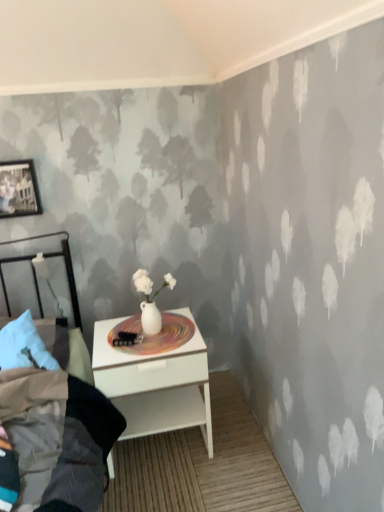
Question: From a real-world perspective, is matte black picture frame at upper left physically above white glossy vase at center?

Choices:
 (A) no
 (B) yes

Answer: (B)

Question: Is matte black picture frame at upper left taller than white glossy vase at center?

Choices:
 (A) no
 (B) yes

Answer: (B)

Question: Does matte black picture frame at upper left have a larger size compared to white glossy vase at center?

Choices:
 (A) no
 (B) yes

Answer: (B)

Question: Does matte black picture frame at upper left have a greater width compared to white glossy vase at center?

Choices:
 (A) no
 (B) yes

Answer: (A)

Question: Is white glossy vase at center surrounded by matte black picture frame at upper left?

Choices:
 (A) no
 (B) yes

Answer: (A)

Question: Is matte black picture frame at upper left oriented away from white glossy vase at center?

Choices:
 (A) no
 (B) yes

Answer: (A)

Question: Is white glossy nightstand at lower center placed right next to matte black picture frame at upper left?

Choices:
 (A) no
 (B) yes

Answer: (A)

Question: Is white glossy nightstand at lower center aimed at matte black picture frame at upper left?

Choices:
 (A) yes
 (B) no

Answer: (B)

Question: Does white glossy nightstand at lower center have a lesser height compared to matte black picture frame at upper left?

Choices:
 (A) yes
 (B) no

Answer: (B)

Question: Is white glossy nightstand at lower center thinner than matte black picture frame at upper left?

Choices:
 (A) no
 (B) yes

Answer: (A)

Question: Is white glossy nightstand at lower center located outside matte black picture frame at upper left?

Choices:
 (A) no
 (B) yes

Answer: (B)

Question: Is white glossy nightstand at lower center further to the viewer compared to matte black picture frame at upper left?

Choices:
 (A) yes
 (B) no

Answer: (B)

Question: Is white glossy vase at center positioned before matte black picture frame at upper left?

Choices:
 (A) no
 (B) yes

Answer: (B)